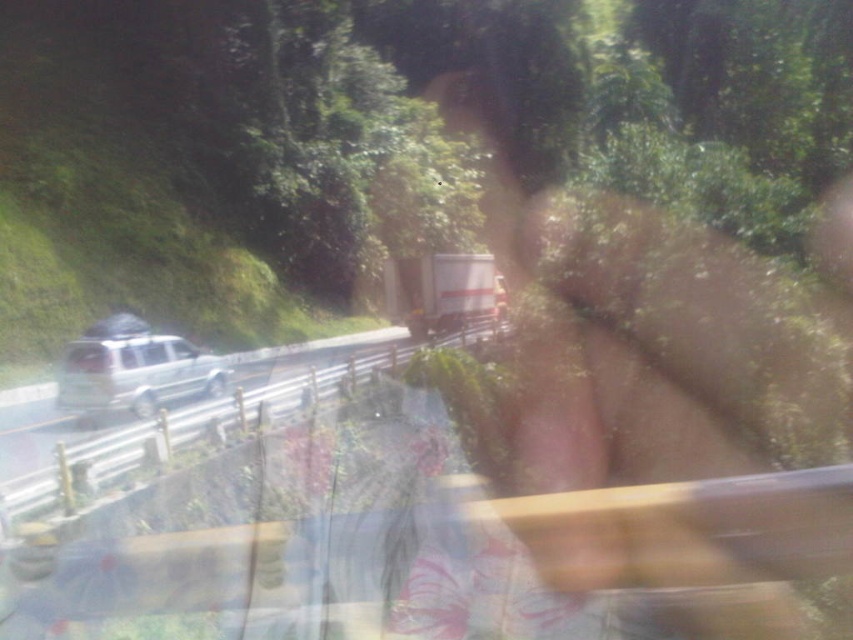
Based on the photo, you are a passenger in a car and notice two vehicles ahead on the road. You see a silver metallic suv at left and a satin silver suv at left. Which one is positioned more to the right side?

The silver metallic suv at left is positioned to the right of the satin silver suv at left.

You are a driver in a car and want to pass the silver metallic suv at left and the satin silver suv at left. Which one should you pass first if you want to pass both?

You should pass the satin silver suv at left first because the silver metallic suv at left is wider and may require more space to safely pass, so it is better to handle the wider vehicle first to ensure safety.